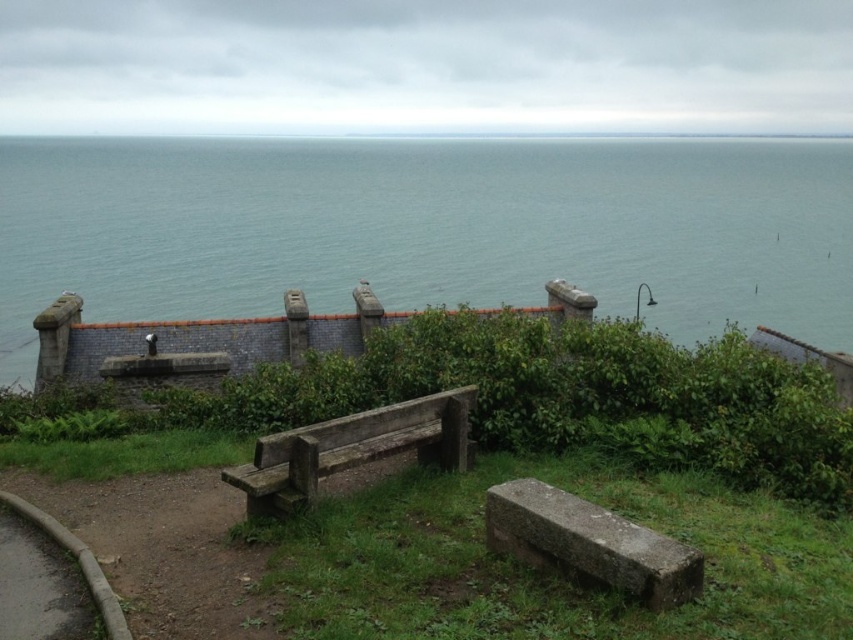
Question: Can you confirm if blue water at upper center is positioned above weathered stone bench at lower right?

Choices:
 (A) yes
 (B) no

Answer: (A)

Question: Considering the relative positions of blue water at upper center and weathered wood bench at center in the image provided, where is blue water at upper center located with respect to weathered wood bench at center?

Choices:
 (A) above
 (B) below

Answer: (A)

Question: Which object appears farthest from the camera in this image?

Choices:
 (A) weathered stone bench at lower right
 (B) blue water at upper center
 (C) weathered wood bench at center

Answer: (B)

Question: Does blue water at upper center have a larger size compared to weathered stone bench at lower right?

Choices:
 (A) yes
 (B) no

Answer: (A)

Question: Based on their relative distances, which object is nearer to the weathered stone bench at lower right?

Choices:
 (A) blue water at upper center
 (B) weathered wood bench at center

Answer: (B)

Question: Which of the following is the farthest from the observer?

Choices:
 (A) blue water at upper center
 (B) weathered stone bench at lower right

Answer: (A)